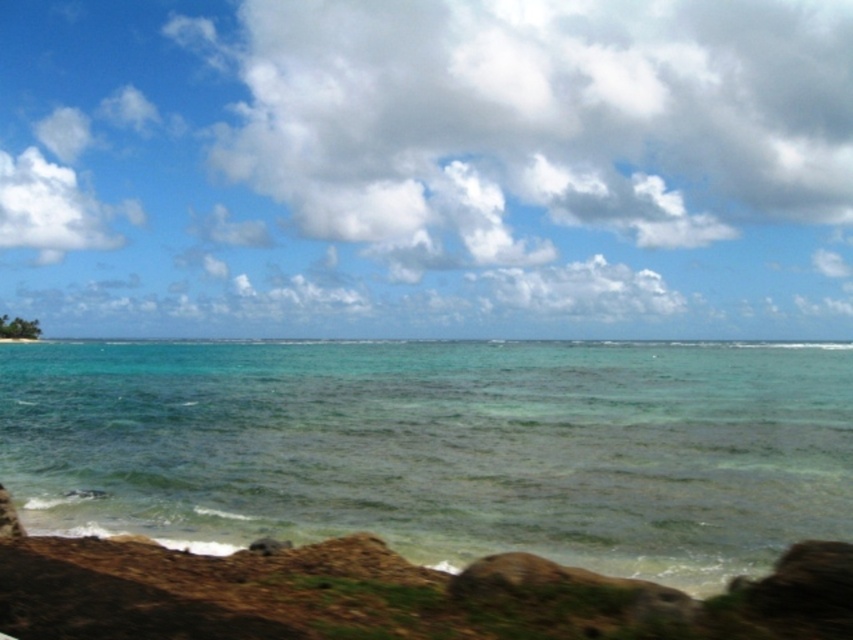
Is clear water at center above white fluffy cloud at upper left?

Incorrect, clear water at center is not positioned above white fluffy cloud at upper left.

Is point (727, 365) positioned behind point (3, 157)?

No, (727, 365) is in front of (3, 157).

Identify the location of clear water at center. The image size is (853, 640). (440, 448).

Measure the distance between point (607, 64) and camera.

Point (607, 64) is 246.38 meters from camera.

Does white fluffy cloud at upper center have a larger size compared to white fluffy cloud at upper left?

Correct, white fluffy cloud at upper center is larger in size than white fluffy cloud at upper left.

Locate an element on the screen. white fluffy cloud at upper center is located at coordinates (543, 120).

Does clear water at center have a greater height compared to white fluffy cloud at upper center?

Incorrect, clear water at center's height is not larger of white fluffy cloud at upper center's.

This screenshot has height=640, width=853. Identify the location of clear water at center. (440, 448).